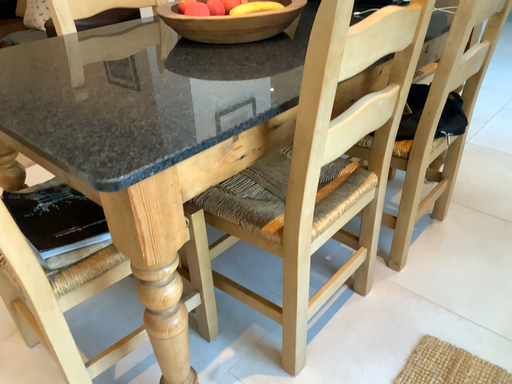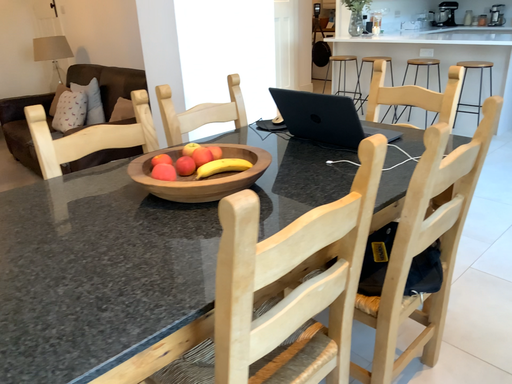
Question: Which way did the camera rotate in the video?

Choices:
 (A) rotated upward
 (B) rotated downward

Answer: (A)